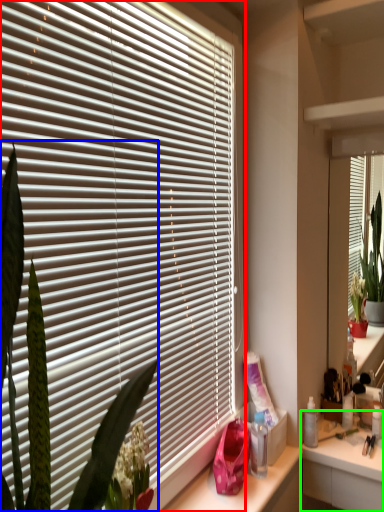
Question: Based on their relative distances, which object is farther from window blind (highlighted by a red box)? Choose from plant (highlighted by a blue box) and counter (highlighted by a green box).

Choices:
 (A) plant
 (B) counter

Answer: (B)